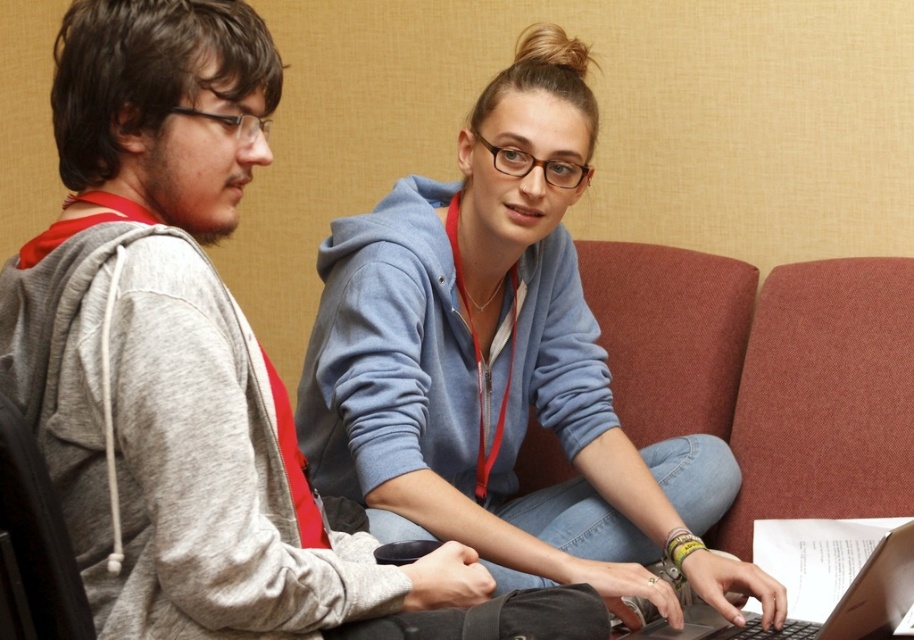
You are a GUI agent. You are given a task and a screenshot of the screen. Output one action in this format:
    pyautogui.click(x=<x>, y=<y>)
    Task: Click on the blue fleece hoodie at center
    
    Given the screenshot: What is the action you would take?
    pyautogui.click(x=505, y=369)

Does blue fleece hoodie at center have a larger size compared to silver metallic laptop at center?

Correct, blue fleece hoodie at center is larger in size than silver metallic laptop at center.

The height and width of the screenshot is (640, 914). I want to click on blue fleece hoodie at center, so click(505, 369).

I want to click on gray matte hoodie at upper left, so click(x=197, y=364).

Is point (208, 296) closer to camera compared to point (852, 627)?

Yes, point (208, 296) is closer to viewer.

Does point (367, 616) come in front of point (881, 609)?

Yes, it is in front of point (881, 609).

This screenshot has height=640, width=914. I want to click on gray matte hoodie at upper left, so click(197, 364).

Does gray matte hoodie at upper left lie behind blue fleece hoodie at center?

No.

Does gray matte hoodie at upper left have a smaller size compared to blue fleece hoodie at center?

Indeed, gray matte hoodie at upper left has a smaller size compared to blue fleece hoodie at center.

Between point (232, 452) and point (590, 177), which one is positioned in front?

Point (232, 452) is more forward.

You are a GUI agent. You are given a task and a screenshot of the screen. Output one action in this format:
    pyautogui.click(x=<x>, y=<y>)
    Task: Click on the gray matte hoodie at upper left
    The image size is (914, 640).
    Given the screenshot: What is the action you would take?
    pyautogui.click(x=197, y=364)